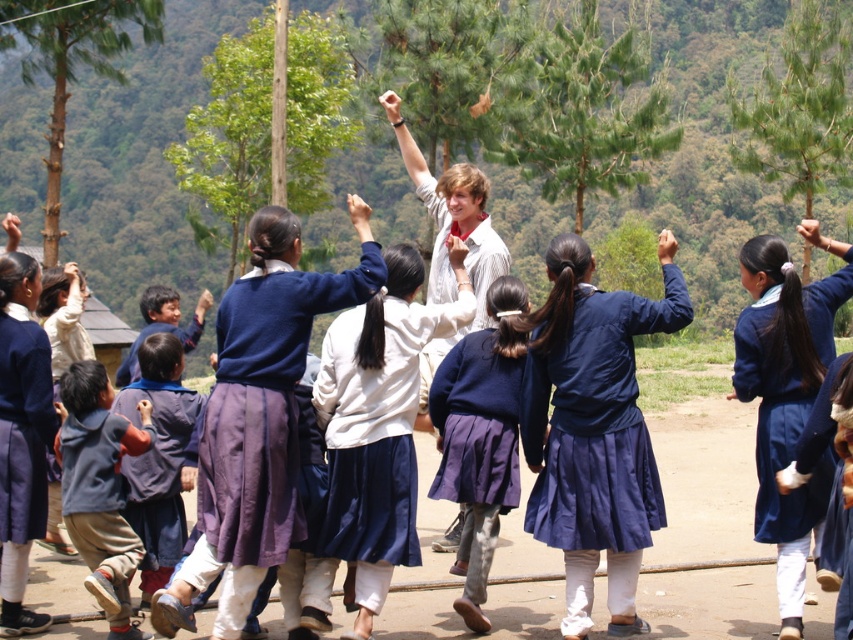
Question: Which of these objects is positioned closest to the matte blue uniform at center?

Choices:
 (A) dark blue skirt at center
 (B) navy blue skirt at center
 (C) dark blue hoodie at lower left

Answer: (B)

Question: Which object is closer to the camera taking this photo?

Choices:
 (A) smooth skin hand at center
 (B) matte blue uniform at center
 (C) smooth wooden stick at upper center

Answer: (B)

Question: Which is farther from the smooth wooden stick at upper center?

Choices:
 (A) matte blue sweater at upper center
 (B) matte blue sweater at center
 (C) smooth skin hand at center
 (D) navy blue skirt at center

Answer: (A)

Question: Is matte blue uniform at center above smooth skin hand at center?

Choices:
 (A) no
 (B) yes

Answer: (A)

Question: Does matte blue sweater at center appear on the right side of dark blue skirt at center?

Choices:
 (A) no
 (B) yes

Answer: (B)

Question: Can you confirm if navy blue skirt at center is wider than matte blue uniform at center?

Choices:
 (A) no
 (B) yes

Answer: (A)